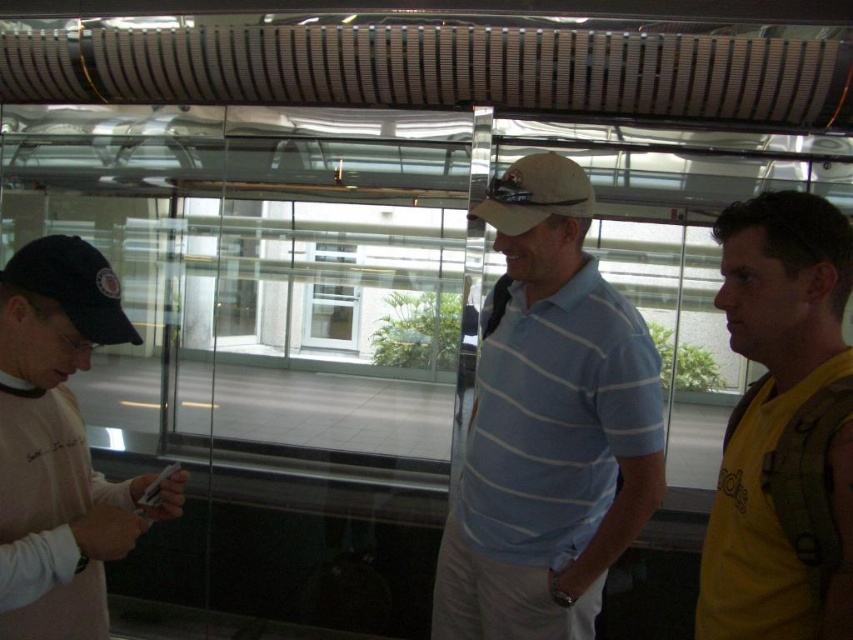
Question: Is light blue striped polo shirt at center thinner than matte khaki baseball cap at center?

Choices:
 (A) no
 (B) yes

Answer: (A)

Question: Which of the following is the closest to the observer?

Choices:
 (A) light blue striped polo shirt at center
 (B) light pink sweater at left
 (C) matte khaki baseball cap at center
 (D) yellow fabric shirt at right

Answer: (D)

Question: Does yellow fabric shirt at right come behind black fabric baseball cap at left?

Choices:
 (A) no
 (B) yes

Answer: (A)

Question: Which object appears closest to the camera in this image?

Choices:
 (A) black fabric baseball cap at left
 (B) light pink sweater at left
 (C) matte khaki baseball cap at center

Answer: (B)

Question: Does yellow fabric shirt at right appear on the right side of matte khaki baseball cap at center?

Choices:
 (A) no
 (B) yes

Answer: (B)

Question: Estimate the real-world distances between objects in this image. Which object is closer to the black fabric baseball cap at left?

Choices:
 (A) light blue striped polo shirt at center
 (B) yellow fabric shirt at right
 (C) matte khaki baseball cap at center

Answer: (C)